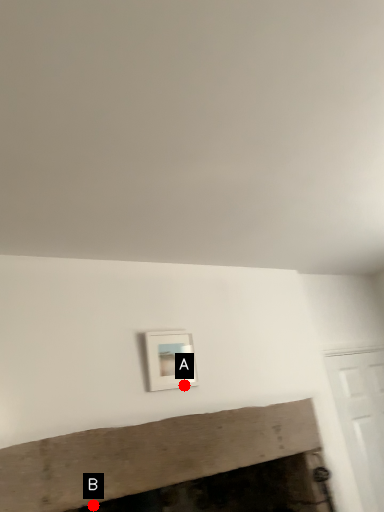
Question: Two points are circled on the image, labeled by A and B beside each circle. Which point is farther from the camera taking this photo?

Choices:
 (A) A is further
 (B) B is further

Answer: (B)